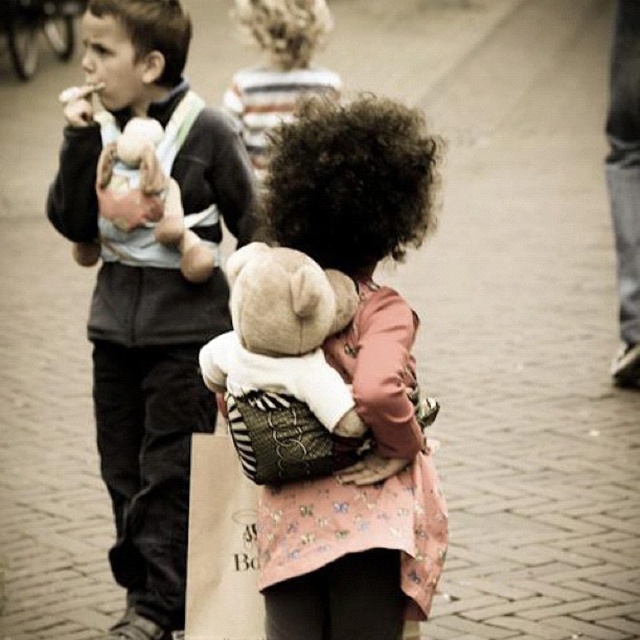
You are standing at the point with coordinates point (266, 456) and want to walk towards the point with coordinates point (424, 614). Will you be walking forward or backward?

Since point (424, 614) is behind point (266, 456), you would need to walk backward to reach it from your current position at point (266, 456).

You are a photographer trying to capture a closeup of both the fluffy pink sweater at center and the fluffy beige teddy bear at center in the scene. Given that your camera can only focus on objects within a 10 inch range, will you be able to get both in focus?

The fluffy pink sweater at center and the fluffy beige teddy bear at center are 11.13 inches apart, which is beyond the camera focus range of 10 inches. Therefore, you won

You are a photographer trying to capture a photo of the matte black jacket at left and the fluffy beige teddy bear at center. Based on their sizes in the image, which object would appear larger in your photo?

The matte black jacket at left appears larger in the photo because it has a greater height compared to the fluffy beige teddy bear at center.